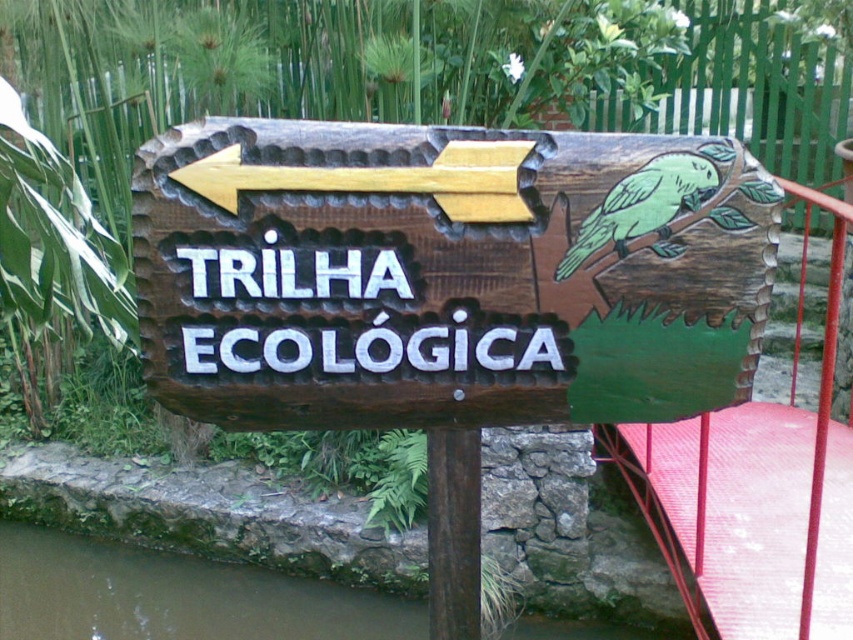
Question: Can you confirm if red metal railing at right is wider than brown wood pole at center?

Choices:
 (A) no
 (B) yes

Answer: (B)

Question: Which point is closer to the camera taking this photo?

Choices:
 (A) (444, 390)
 (B) (437, 486)
 (C) (451, 196)
 (D) (762, 460)

Answer: (C)

Question: Which point is farther from the camera taking this photo?

Choices:
 (A) (294, 186)
 (B) (451, 458)

Answer: (B)

Question: Is the position of wooden sign at center more distant than that of brown wood pole at center?

Choices:
 (A) yes
 (B) no

Answer: (B)

Question: Is red metal railing at right positioned behind wooden at left?

Choices:
 (A) no
 (B) yes

Answer: (B)

Question: Which object is closer to the camera taking this photo?

Choices:
 (A) wooden sign at center
 (B) wooden at left
 (C) brown wood pole at center
 (D) red metal railing at right

Answer: (A)